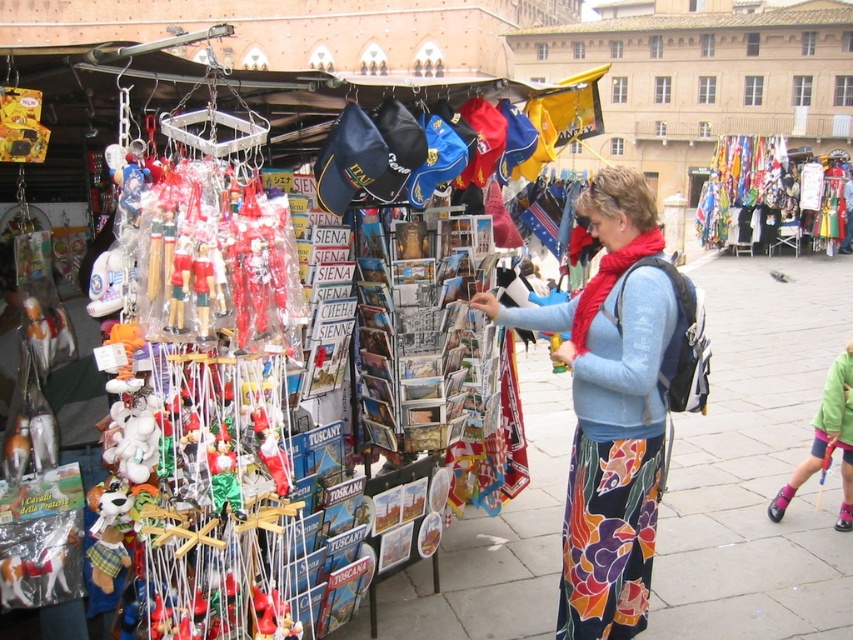
Question: Among these objects, which one is nearest to the camera?

Choices:
 (A) floral cotton skirt at center
 (B) plastic pink toy at lower right

Answer: (A)

Question: From the image, what is the correct spatial relationship of floral cotton skirt at center in relation to plastic pink toy at lower right?

Choices:
 (A) left
 (B) right

Answer: (A)

Question: Which point is farther from the camera taking this photo?

Choices:
 (A) (843, 368)
 (B) (608, 632)

Answer: (A)

Question: Among these objects, which one is farthest from the camera?

Choices:
 (A) floral cotton skirt at center
 (B) plastic pink toy at lower right

Answer: (B)

Question: Can you confirm if floral cotton skirt at center is smaller than plastic pink toy at lower right?

Choices:
 (A) no
 (B) yes

Answer: (A)

Question: Can you confirm if floral cotton skirt at center is positioned to the left of plastic pink toy at lower right?

Choices:
 (A) yes
 (B) no

Answer: (A)